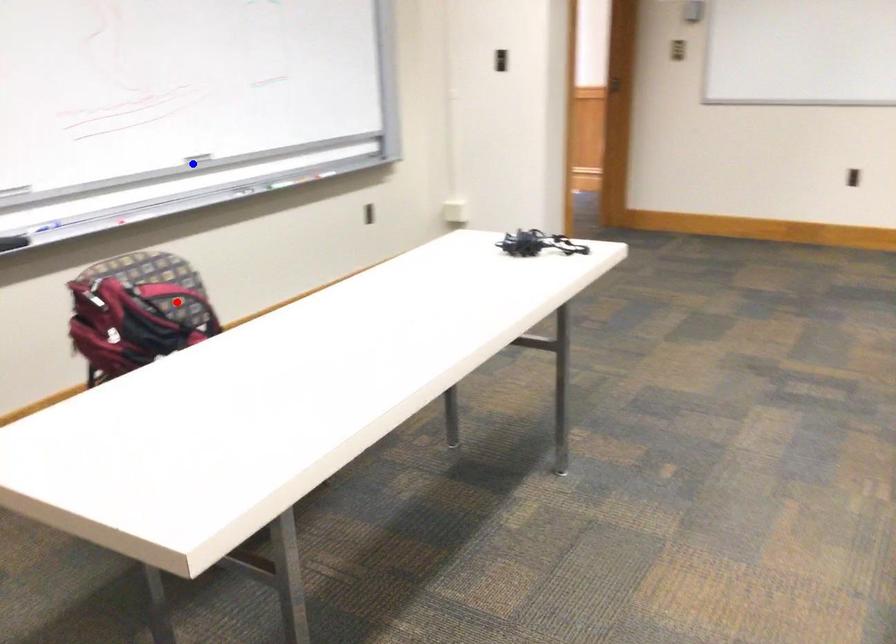
Question: Which of the two points in the image is closer to the camera?

Choices:
 (A) Blue point is closer.
 (B) Red point is closer.

Answer: (B)